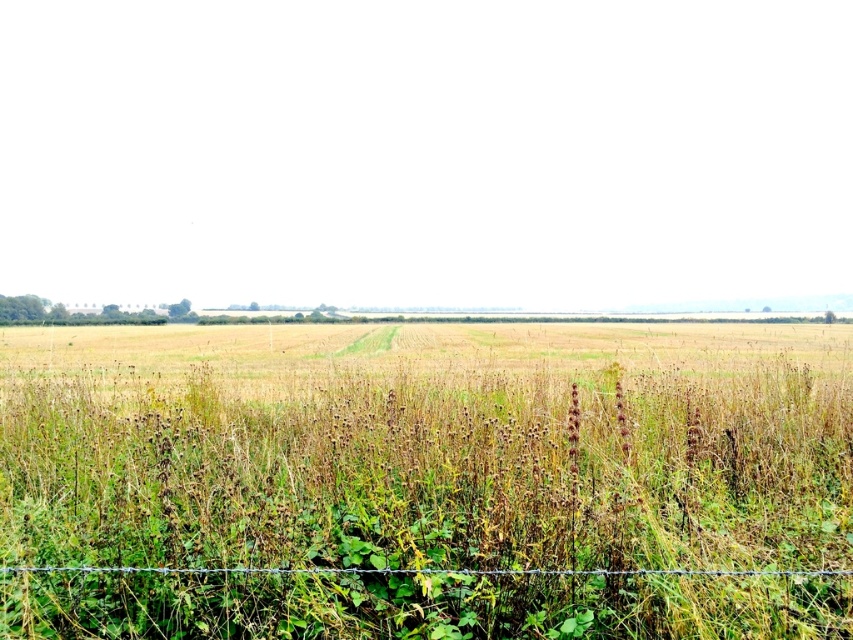
You are standing at the edge of the field and see the green grass at center and the wire at bottom. Which object is closer to your right side?

The green grass at center is to the right of the wire at bottom, so the green grass at center is closer to your right side.